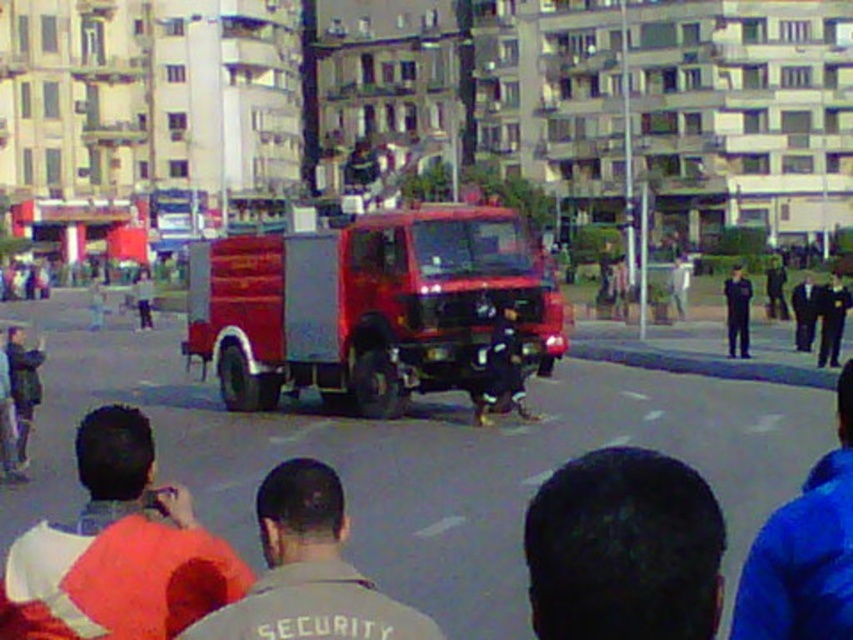
Question: Which object is the farthest from the gray fabric security guard at center?

Choices:
 (A) dark hair at center
 (B) dark blue uniform at center

Answer: (B)

Question: Is dark hair at center positioned behind gray fabric security guard at center?

Choices:
 (A) yes
 (B) no

Answer: (B)

Question: Can you confirm if blue fabric jacket at lower right is smaller than dark blue uniform at center?

Choices:
 (A) no
 (B) yes

Answer: (B)

Question: Is shiny red fire truck at center thinner than dark hair at center?

Choices:
 (A) no
 (B) yes

Answer: (A)

Question: Estimate the real-world distances between objects in this image. Which object is farther from the gray fabric security guard at center?

Choices:
 (A) shiny red fire truck at center
 (B) blue fabric jacket at lower right
 (C) dark blue uniform at center
 (D) dark hair at center

Answer: (C)

Question: Which of the following is the farthest from the observer?

Choices:
 (A) (746, 352)
 (B) (277, 593)
 (C) (13, 566)

Answer: (A)